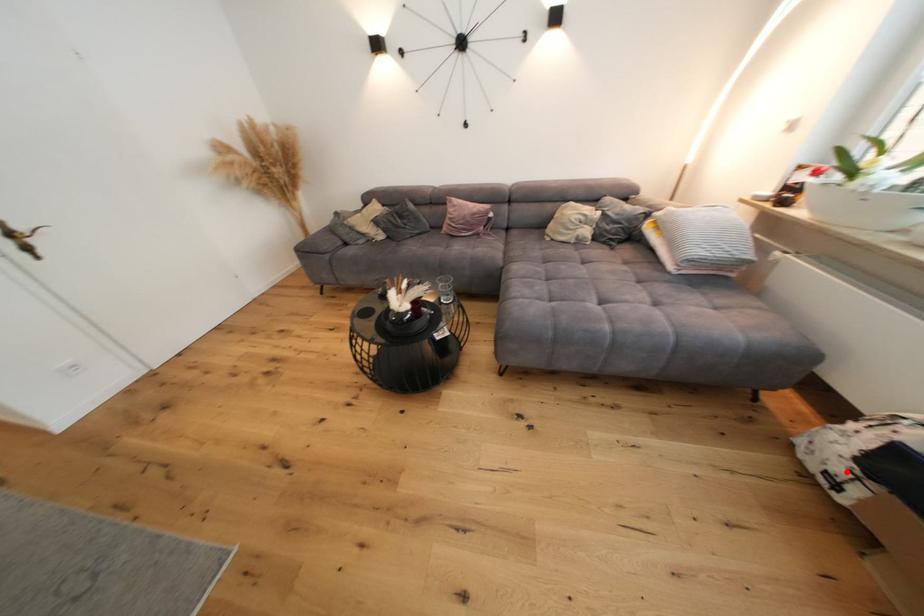
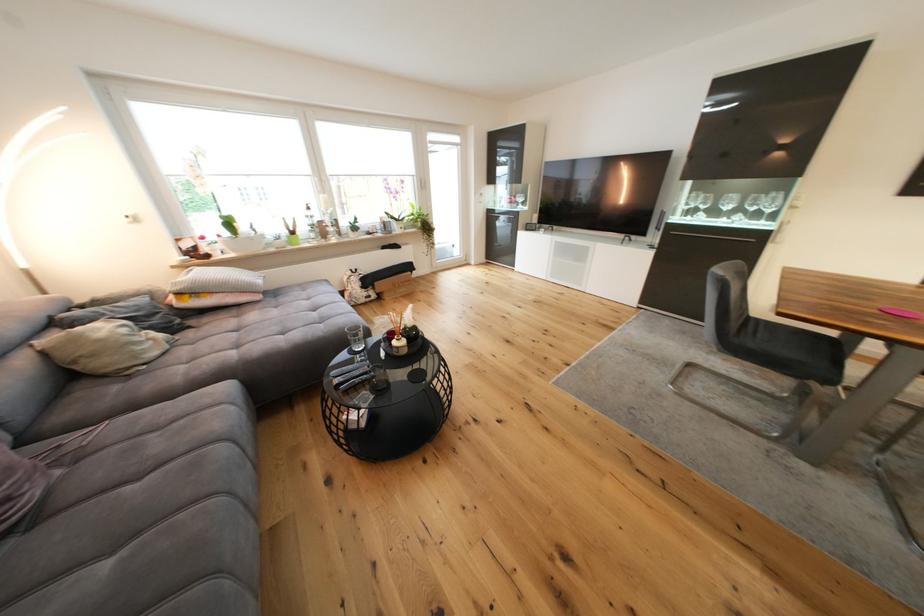
Find the pixel in the second image that matches the highlighted location in the first image.

(372, 296)